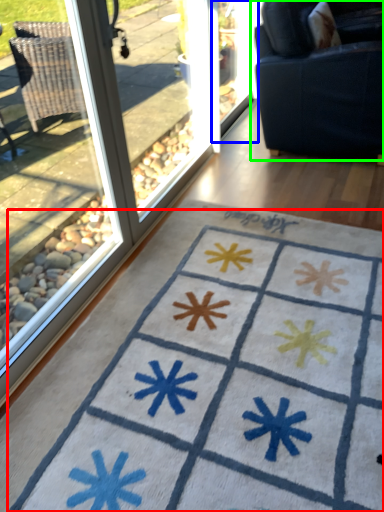
Question: Estimate the real-world distances between objects in this image. Which object is closer to doormat (highlighted by a red box), screen door (highlighted by a blue box) or studio couch (highlighted by a green box)?

Choices:
 (A) screen door
 (B) studio couch

Answer: (B)